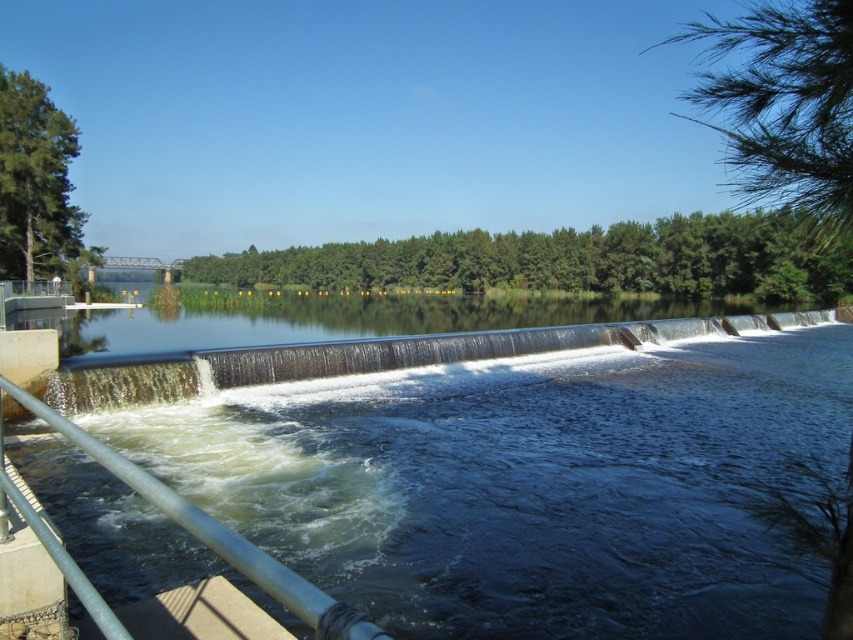
Question: Is dark blue water at center thinner than metal/rustic rail at lower left?

Choices:
 (A) yes
 (B) no

Answer: (B)

Question: Which object appears closest to the camera in this image?

Choices:
 (A) dark blue water at center
 (B) metal/rustic rail at lower left

Answer: (B)

Question: Can you confirm if dark blue water at center is positioned above metal/rustic rail at lower left?

Choices:
 (A) yes
 (B) no

Answer: (B)

Question: Is dark blue water at center positioned behind metal/rustic rail at lower left?

Choices:
 (A) yes
 (B) no

Answer: (A)